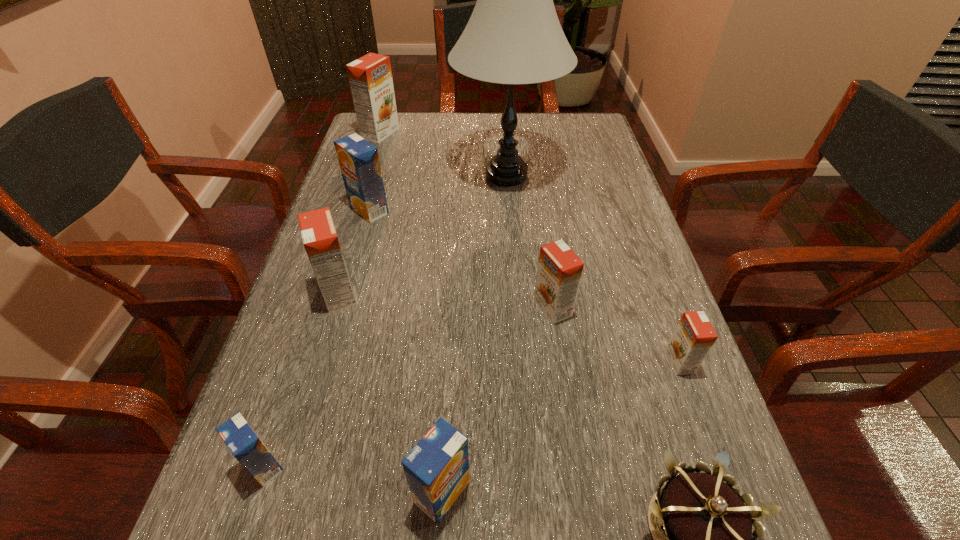
You are a GUI agent. You are given a task and a screenshot of the screen. Output one action in this format:
    pyautogui.click(x=<x>, y=<y>)
    Task: Click on the vacant area at the right edge
    
    Given the screenshot: What is the action you would take?
    pyautogui.click(x=646, y=261)

Locate an element on the screen. free space at the far right corner of the desktop is located at coordinates (601, 147).

The image size is (960, 540). I want to click on free space between the biggest orange orange juice and the fourth nearest object, so point(530,247).

Where is `vacant area that lies between the smallest blue orange_juice and the second orange juice from right to left`? The height and width of the screenshot is (540, 960). vacant area that lies between the smallest blue orange_juice and the second orange juice from right to left is located at coordinates pyautogui.click(x=408, y=387).

What are the coordinates of `vacant space in between the farthest blue orange_juice and the rightmost blue orange_juice` in the screenshot? It's located at (406, 351).

This screenshot has width=960, height=540. Identify the location of free point between the second farthest orange juice and the third smallest orange orange juice. (354, 252).

In order to click on vacant area that lies between the sixth nearest orange juice and the third orange juice from right to left in this screenshot , I will do `click(406, 351)`.

The image size is (960, 540). Identify the location of empty space that is in between the farthest orange orange juice and the rightmost orange juice. (530, 247).

Identify the location of object that stands as the sixth closest to the smallest blue orange_juice. Image resolution: width=960 pixels, height=540 pixels. (694, 336).

Identify the location of object that is the third nearest to the gold crown. The width and height of the screenshot is (960, 540). (559, 272).